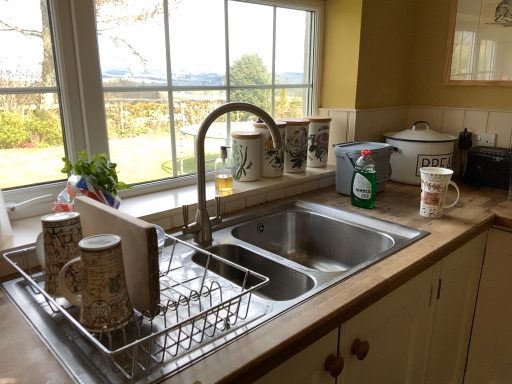
Where is `vacant space to the right of brown ceramic mug at left, which is the 1th mug in bottom-to-top order`? vacant space to the right of brown ceramic mug at left, which is the 1th mug in bottom-to-top order is located at coordinates (184, 317).